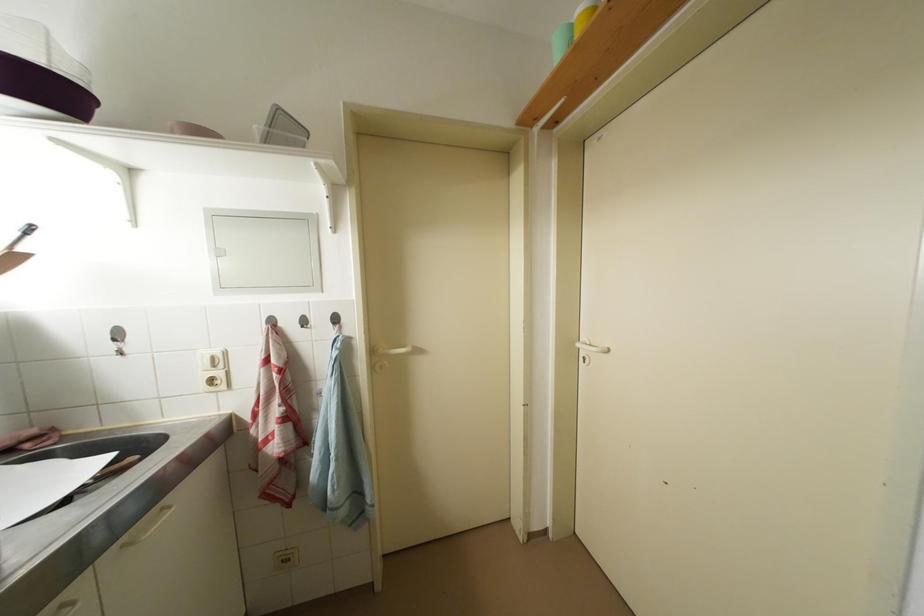
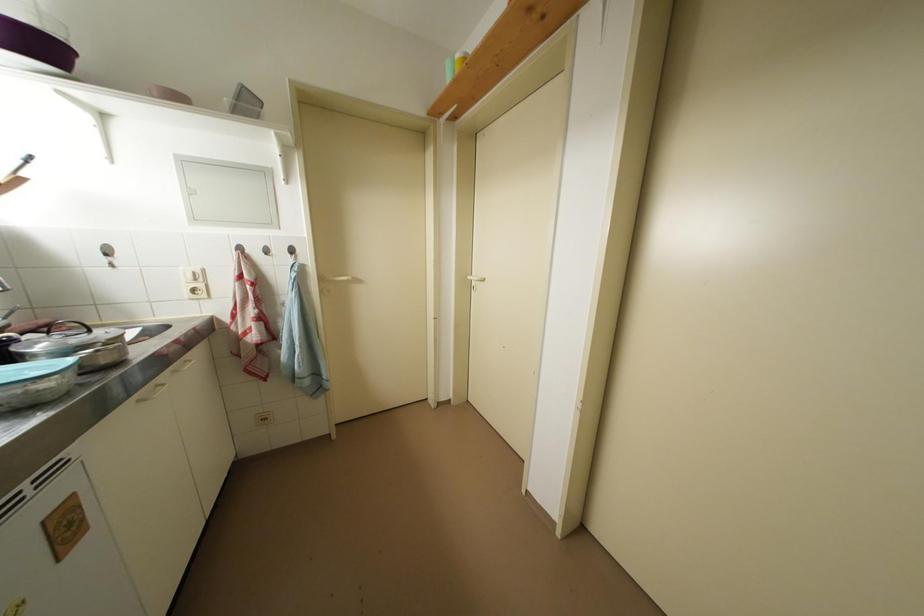
Question: How did the camera likely rotate?

Choices:
 (A) Left
 (B) Right
 (C) Up
 (D) Down

Answer: (B)